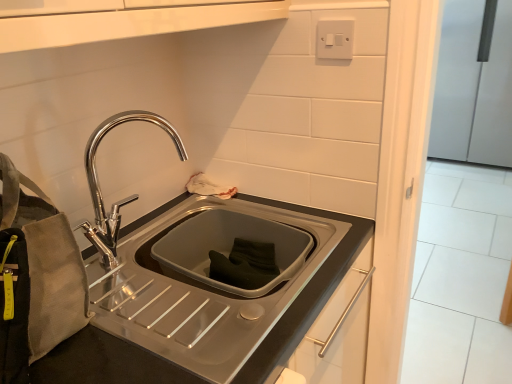
Question: Visually, is white plastic switch at upper right positioned to the left or to the right of canvas pouch at left?

Choices:
 (A) left
 (B) right

Answer: (B)

Question: From the image's perspective, is white plastic switch at upper right located above or below canvas pouch at left?

Choices:
 (A) below
 (B) above

Answer: (B)

Question: Which object is positioned closest to the satin silver refrigerator at right?

Choices:
 (A) white plastic switch at upper right
 (B) canvas pouch at left
 (C) polished metal faucet at upper left

Answer: (A)

Question: Which object is positioned closest to the polished metal faucet at upper left?

Choices:
 (A) satin silver refrigerator at right
 (B) white plastic switch at upper right
 (C) canvas pouch at left

Answer: (C)